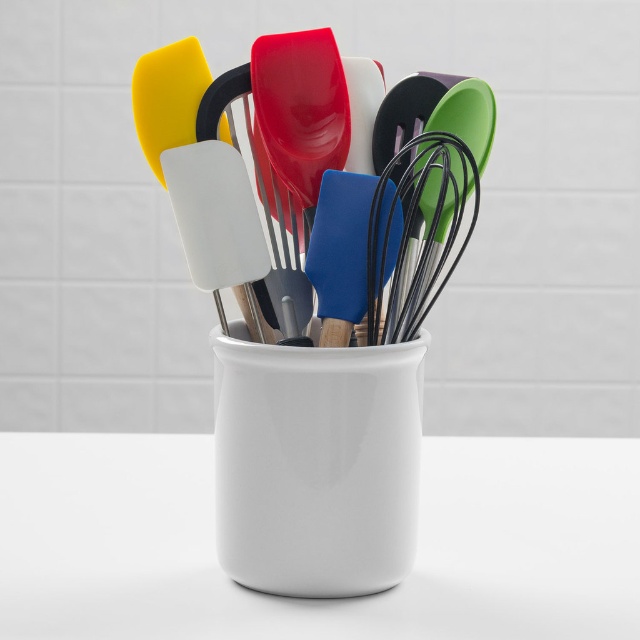
You are standing in front of the kitchen countertop with the white ceramic container. There are two points marked on the container at coordinates point (400,326) and point (163,125). If you want to place a sticker on the container closer to you, which point should you choose?

Point (400,326) is further to the viewer than point (163,125), so you should choose point (400,326) to place the sticker closer to you.

What object is located at the coordinates point (422, 234)?

The point (422, 234) corresponds to the black wire whisk at center.